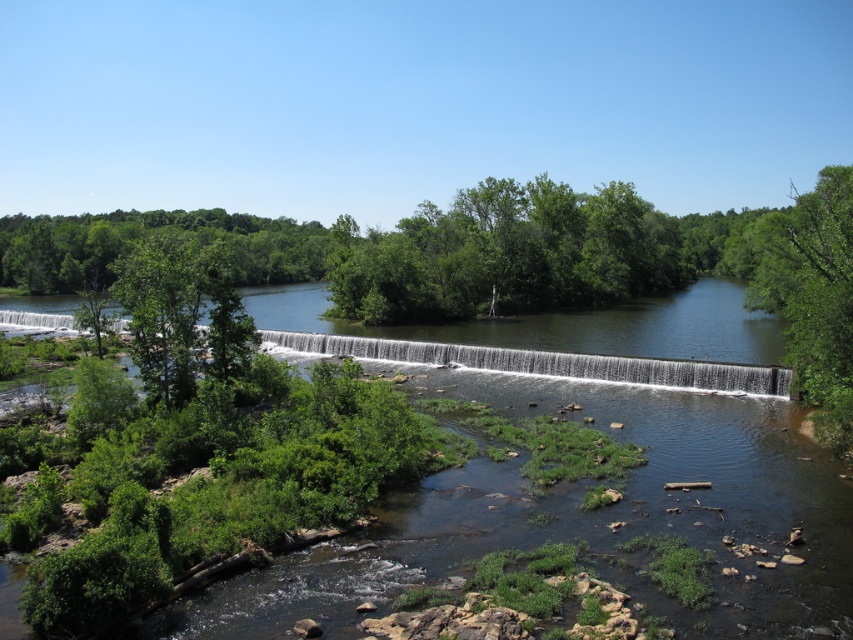
You are standing at the center of the image and want to walk towards the green leafy tree at right. Which direction should you face to move directly towards it?

The green leafy tree at right is located at point coordinates of 0.466 on the x axis and 0.953 on the y axis. Since the y coordinate is closer to 1, which typically represents the bottom of the image, the tree is positioned near the lower part of the image. Therefore, to walk towards it from the center, you should face downward or towards the bottom of the image.